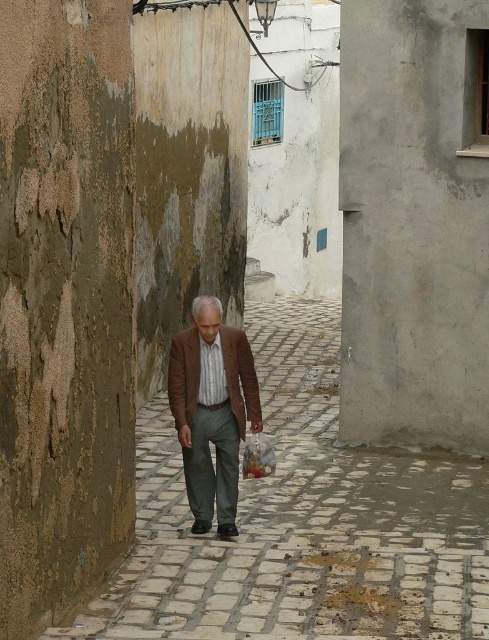
Question: Does brown textured jacket at center appear under brown leather jacket at center?

Choices:
 (A) no
 (B) yes

Answer: (B)

Question: Can you confirm if white stone pavement at center is wider than brown leather jacket at center?

Choices:
 (A) no
 (B) yes

Answer: (B)

Question: Which point appears closest to the camera in this image?

Choices:
 (A) (264, 480)
 (B) (193, 413)
 (C) (222, 392)

Answer: (C)

Question: Among these points, which one is farthest from the camera?

Choices:
 (A) (378, 580)
 (B) (201, 388)
 (C) (195, 358)

Answer: (B)

Question: Does brown textured jacket at center have a larger size compared to brown leather jacket at center?

Choices:
 (A) no
 (B) yes

Answer: (B)

Question: Among these points, which one is farthest from the camera?

Choices:
 (A) (319, 474)
 (B) (222, 348)

Answer: (A)